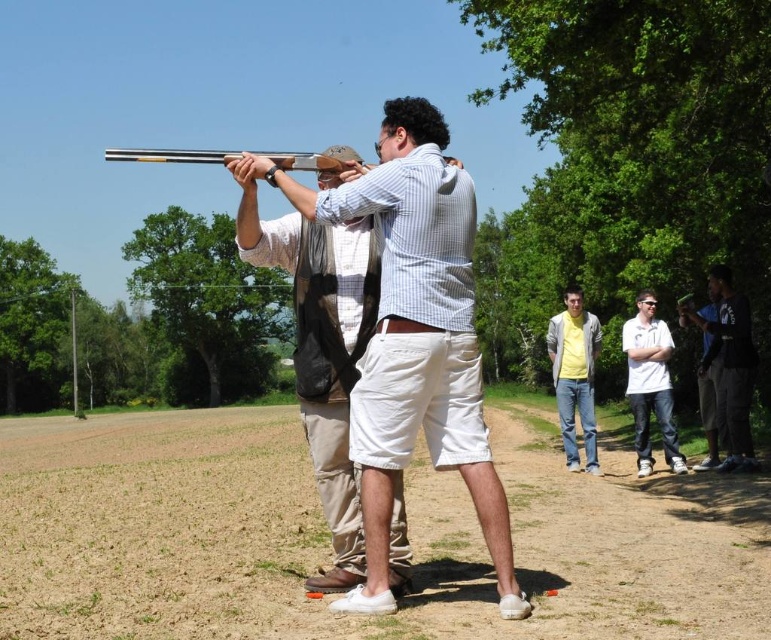
Does white matte shirt at center have a lesser width compared to yellow brushed cotton shirt at center?

Correct, white matte shirt at center's width is less than yellow brushed cotton shirt at center's.

Find the location of a particular element. white matte shirt at center is located at coordinates (650, 384).

Who is positioned more to the left, dark blue jeans at right or white matte shirt at center?

From the viewer's perspective, white matte shirt at center appears more on the left side.

Does dark blue jeans at right have a lesser height compared to white matte shirt at center?

Incorrect, dark blue jeans at right's height does not fall short of white matte shirt at center's.

The width and height of the screenshot is (771, 640). Describe the element at coordinates (729, 365) in the screenshot. I see `dark blue jeans at right` at that location.

Where is `dark blue jeans at right`? dark blue jeans at right is located at coordinates (729, 365).

From the picture: Is matte black shotgun at center positioned behind matte brown shotgun at center?

No, it is in front of matte brown shotgun at center.

Is matte black shotgun at center thinner than matte brown shotgun at center?

Yes, matte black shotgun at center is thinner than matte brown shotgun at center.

Find the location of a particular element. matte black shotgun at center is located at coordinates (416, 337).